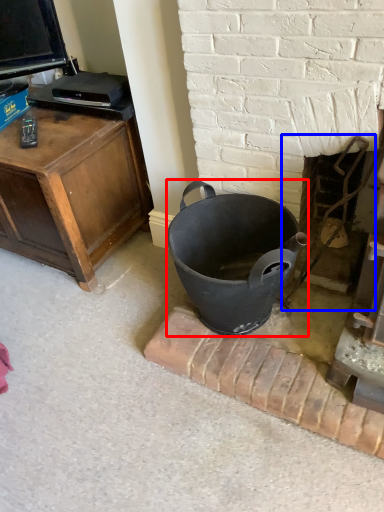
Question: Which object is closer to the camera taking this photo, trash bin/can (highlighted by a red box) or fireplace (highlighted by a blue box)?

Choices:
 (A) trash bin/can
 (B) fireplace

Answer: (A)